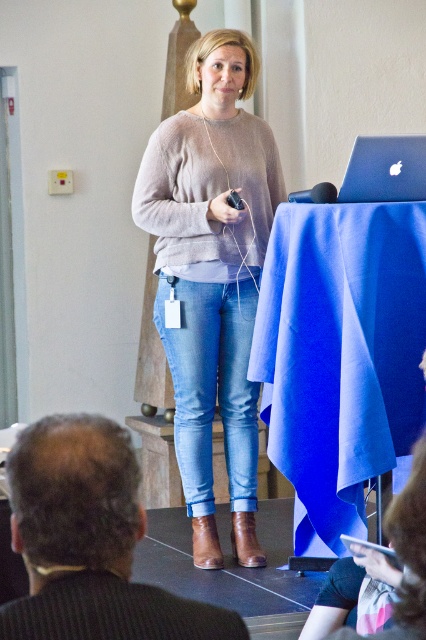
Does matte beige sweater at center have a larger size compared to denim jeans at center?

Yes, matte beige sweater at center is bigger than denim jeans at center.

Does matte beige sweater at center come in front of denim jeans at center?

Yes.

Locate an element on the screen. The height and width of the screenshot is (640, 426). matte beige sweater at center is located at coordinates (213, 275).

This screenshot has width=426, height=640. I want to click on matte beige sweater at center, so click(213, 275).

Between point (305, 353) and point (201, 497), which one is positioned in front?

Positioned in front is point (305, 353).

Which is behind, point (287, 378) or point (158, 257)?

Point (158, 257)

Is point (322, 323) positioned after point (181, 225)?

No, it is in front of (181, 225).

The height and width of the screenshot is (640, 426). I want to click on blue fabric at center, so pyautogui.click(x=339, y=355).

Consider the image. Can you confirm if matte beige sweater at center is shorter than sleek silver laptop at upper right?

No.

Which of these two, matte beige sweater at center or sleek silver laptop at upper right, stands shorter?

Standing shorter between the two is sleek silver laptop at upper right.

You are a GUI agent. You are given a task and a screenshot of the screen. Output one action in this format:
    pyautogui.click(x=<x>, y=<y>)
    Task: Click on the matte beige sweater at center
    This screenshot has width=426, height=640.
    Given the screenshot: What is the action you would take?
    pyautogui.click(x=213, y=275)

Locate an element on the screen. The height and width of the screenshot is (640, 426). matte beige sweater at center is located at coordinates (213, 275).